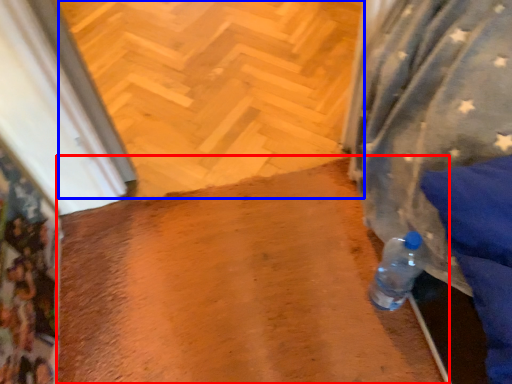
Question: Which point is further to the camera, wide (highlighted by a red box) or path (highlighted by a blue box)?

Choices:
 (A) wide
 (B) path

Answer: (B)